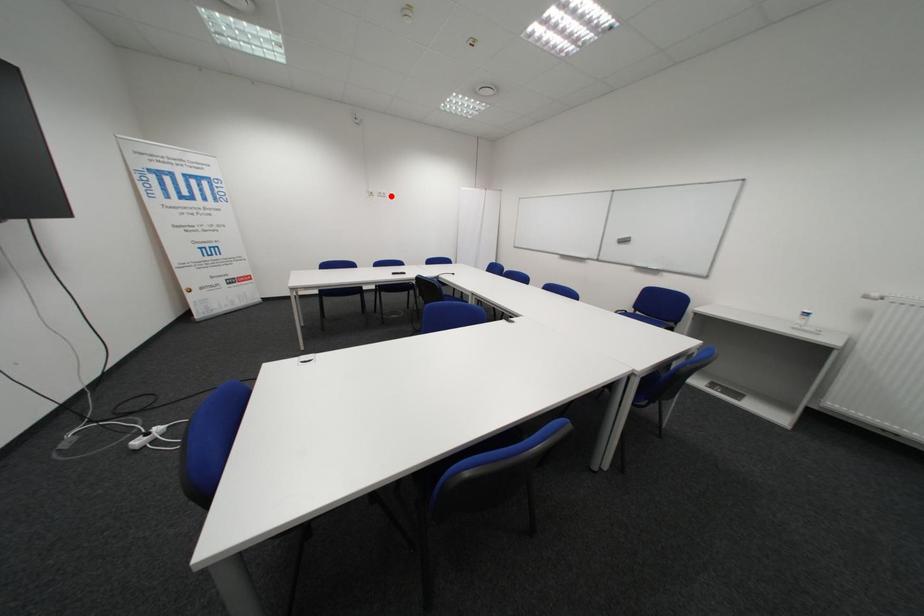
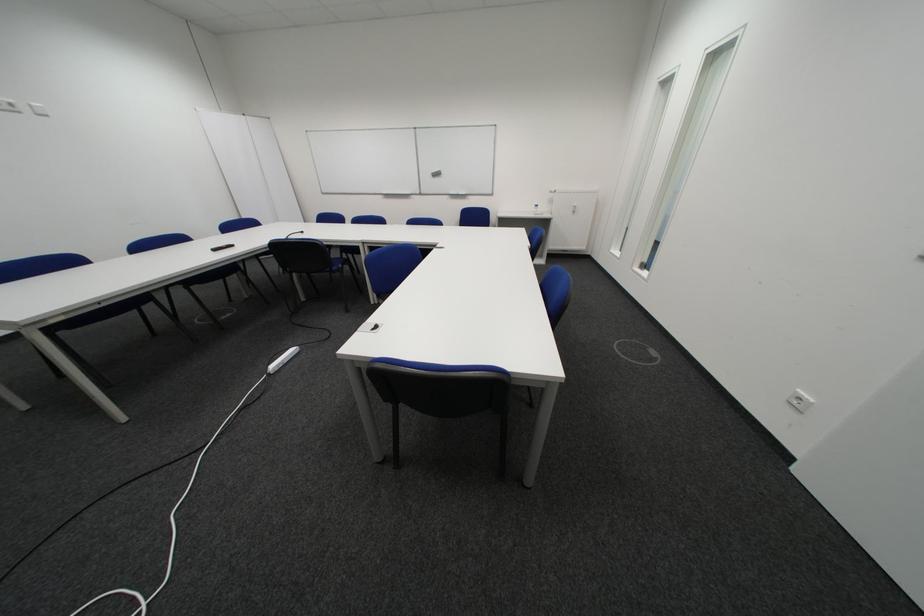
Question: I am providing you with two images of the same scene from different viewpoints. Given a red point in image1, look at the same physical point in image2. Is it:

Choices:
 (A) Closer to the viewpoint
 (B) Farther from the viewpoint

Answer: (B)